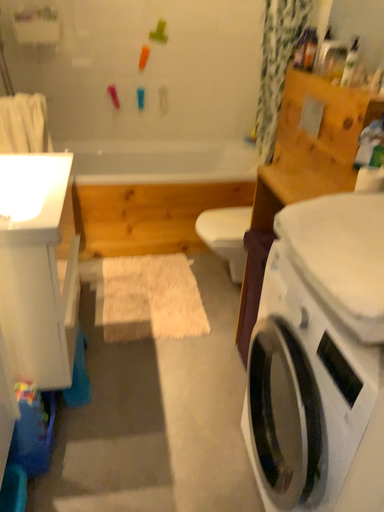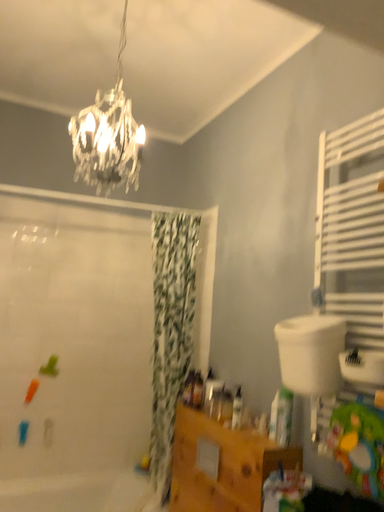
Question: How did the camera likely rotate when shooting the video?

Choices:
 (A) rotated downward
 (B) rotated upward

Answer: (B)